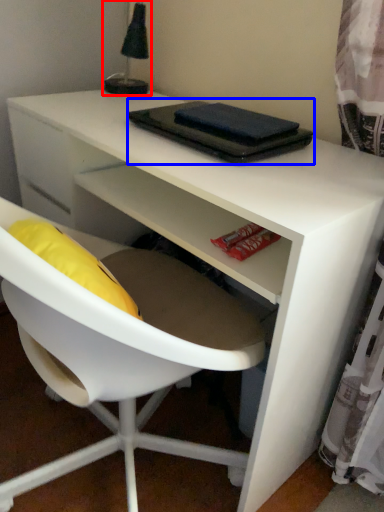
Question: Which object is further to the camera taking this photo, table lamp (highlighted by a red box) or notebook (highlighted by a blue box)?

Choices:
 (A) table lamp
 (B) notebook

Answer: (A)